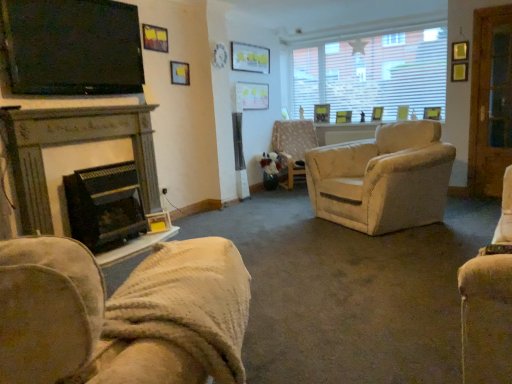
Question: Would you consider beige fabric chair at center, acting as the 2th chair starting from the left, to be distant from dark gray stone fireplace at left, marked as the first fireplace in a top-to-bottom arrangement?

Choices:
 (A) no
 (B) yes

Answer: (B)

Question: Is beige fabric chair at center, the 1th chair positioned from the right, outside dark gray stone fireplace at left, which appears as the second fireplace when ordered from the bottom?

Choices:
 (A) no
 (B) yes

Answer: (B)

Question: Can you confirm if beige fabric chair at center, acting as the 2th chair starting from the left, is positioned to the left of dark gray stone fireplace at left, marked as the first fireplace in a top-to-bottom arrangement?

Choices:
 (A) yes
 (B) no

Answer: (B)

Question: Does beige fabric chair at center, the 1th chair in the back-to-front sequence, have a greater height compared to dark gray stone fireplace at left, marked as the first fireplace in a top-to-bottom arrangement?

Choices:
 (A) yes
 (B) no

Answer: (B)

Question: From a real-world perspective, does beige fabric chair at center, which is counted as the 1th chair, starting from the top, stand above dark gray stone fireplace at left, marked as the first fireplace in a top-to-bottom arrangement?

Choices:
 (A) no
 (B) yes

Answer: (A)

Question: From the image's perspective, is beige fabric chair at center, the second chair in the front-to-back sequence, below dark gray stone fireplace at left, which appears as the second fireplace when ordered from the bottom?

Choices:
 (A) no
 (B) yes

Answer: (A)

Question: Considering the relative positions of velvet beige armchair at lower left, which is the 1th chair from front to back, and beige fabric chair at center, acting as the 2th chair starting from the left, in the image provided, is velvet beige armchair at lower left, which is the 1th chair from front to back, to the left of beige fabric chair at center, acting as the 2th chair starting from the left, from the viewer's perspective?

Choices:
 (A) yes
 (B) no

Answer: (A)

Question: Can you confirm if velvet beige armchair at lower left, the second chair from the back, is bigger than beige fabric chair at center, which is counted as the 1th chair, starting from the top?

Choices:
 (A) no
 (B) yes

Answer: (A)

Question: Is velvet beige armchair at lower left, the second chair from the back, positioned beyond the bounds of beige fabric chair at center, the second chair in the front-to-back sequence?

Choices:
 (A) no
 (B) yes

Answer: (B)

Question: Is velvet beige armchair at lower left, which is counted as the first chair, starting from the bottom, wider than beige fabric chair at center, which ranks as the second chair in bottom-to-top order?

Choices:
 (A) no
 (B) yes

Answer: (B)

Question: Considering the relative sizes of velvet beige armchair at lower left, which is counted as the first chair, starting from the bottom, and beige fabric chair at center, acting as the 2th chair starting from the left, in the image provided, is velvet beige armchair at lower left, which is counted as the first chair, starting from the bottom, smaller than beige fabric chair at center, acting as the 2th chair starting from the left,?

Choices:
 (A) yes
 (B) no

Answer: (A)

Question: From the image's perspective, is velvet beige armchair at lower left, the 2th chair positioned from the top, under beige fabric chair at center, which ranks as the second chair in bottom-to-top order?

Choices:
 (A) no
 (B) yes

Answer: (B)

Question: Is matte white picture frame at upper center wider than white textured window at upper right?

Choices:
 (A) yes
 (B) no

Answer: (A)